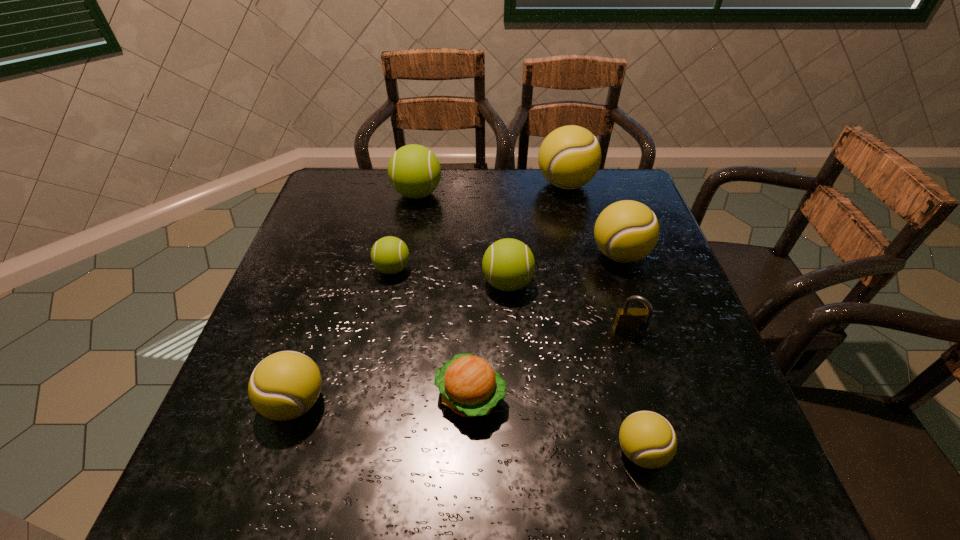
The image size is (960, 540). In order to click on the closest green tennis ball to the smallest green tennis ball in this screenshot , I will do `click(508, 264)`.